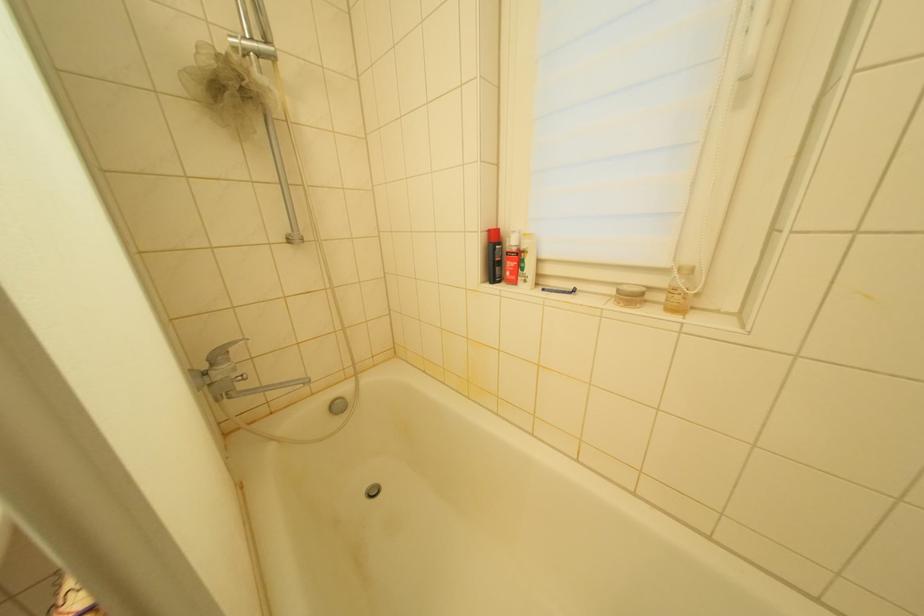
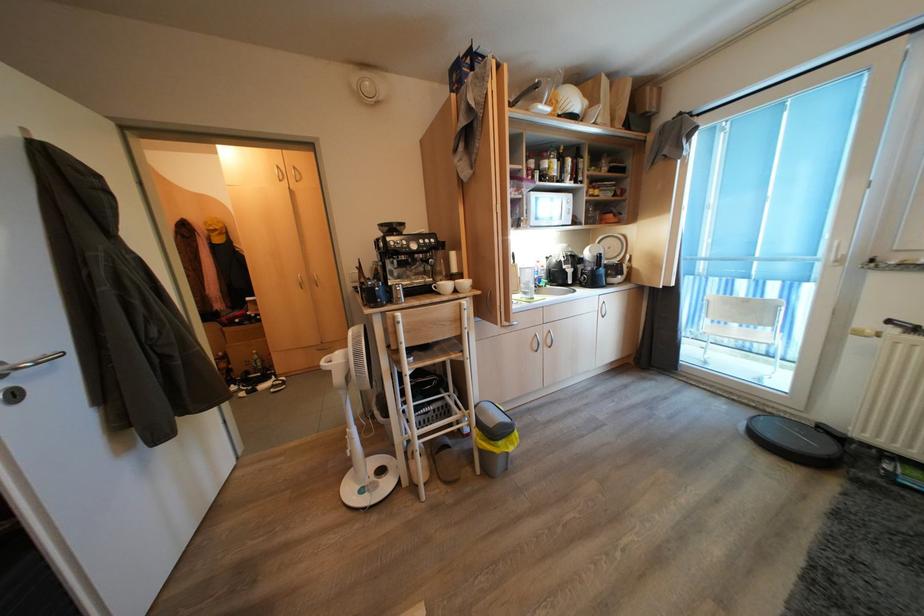
Question: The images are taken continuously from a first-person perspective. In which direction are you moving?

Choices:
 (A) Left
 (B) Right
 (C) Forward
 (D) Backward

Answer: (D)